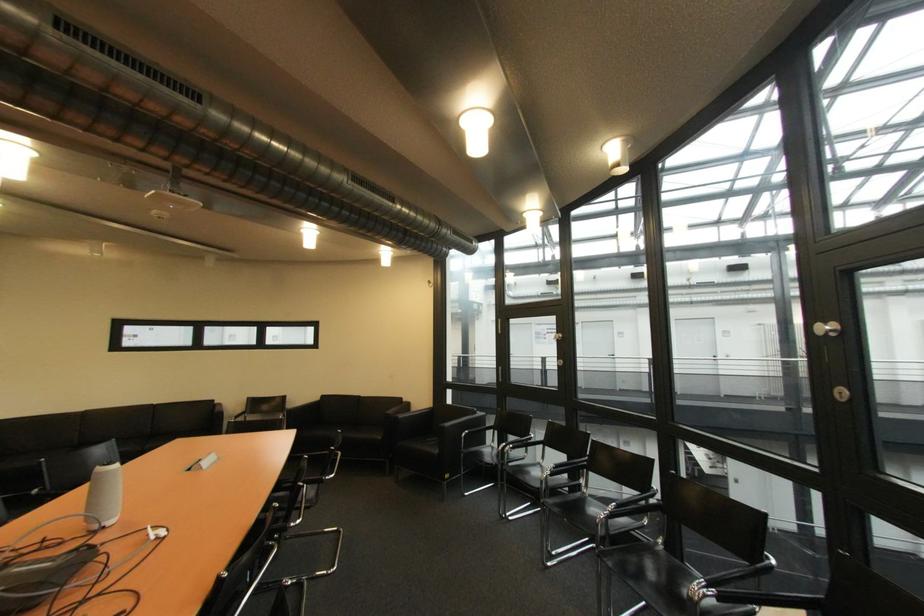
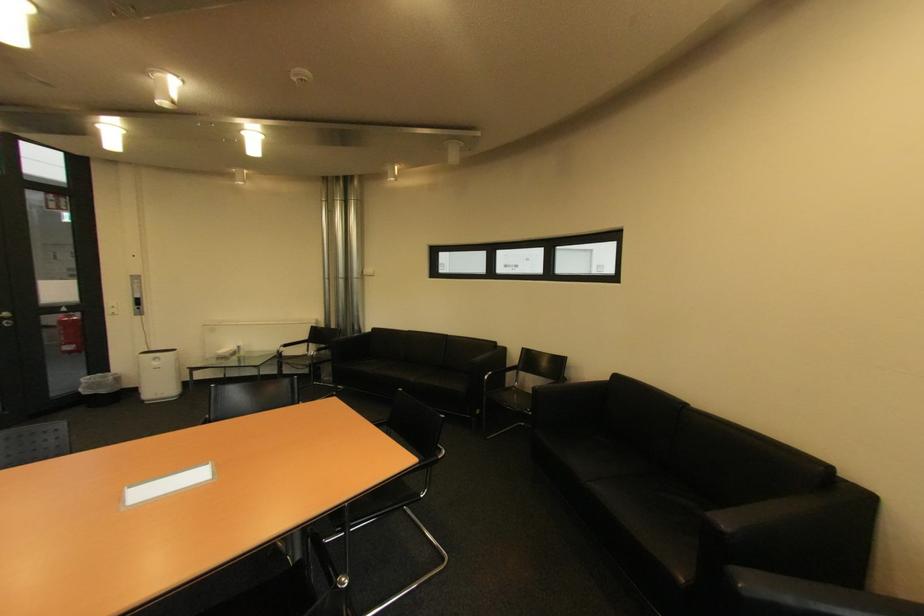
Locate, in the second image, the point that corresponds to [331,398] in the first image.

(625, 378)